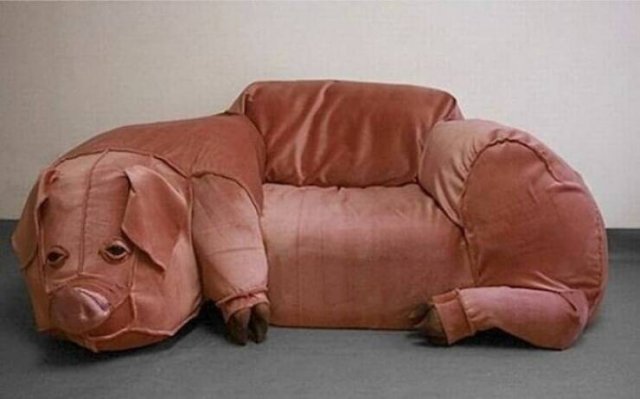
Where is `wall`? The height and width of the screenshot is (399, 640). wall is located at coordinates (525, 58).